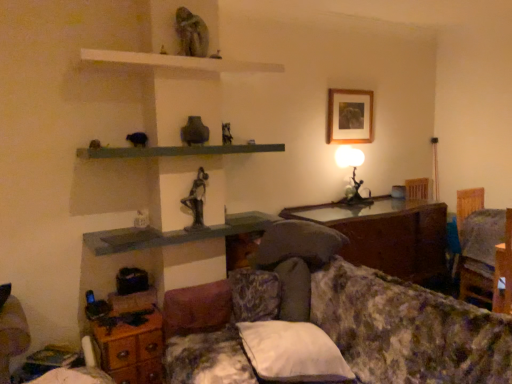
Locate an element on the screen. The image size is (512, 384). vacant region to the left of bronze statue at center is located at coordinates (170, 227).